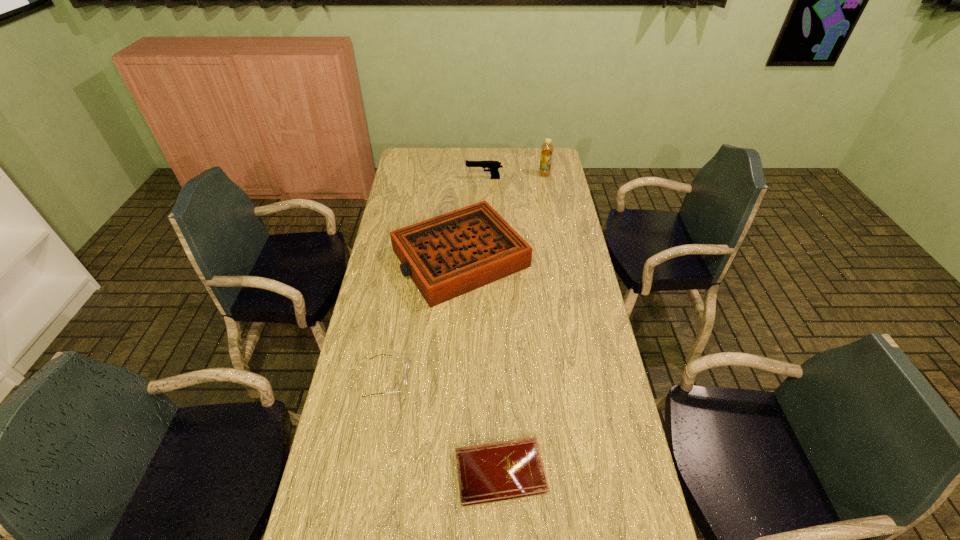
I want to click on the rightmost object, so click(547, 148).

In order to click on bottle in this screenshot , I will do `click(547, 148)`.

Identify the location of pistol. This screenshot has height=540, width=960. [493, 165].

The height and width of the screenshot is (540, 960). I want to click on gameboard, so click(449, 255).

This screenshot has width=960, height=540. I want to click on the fourth farthest object, so click(x=407, y=364).

Identify the location of the fourth tallest object. (407, 364).

Image resolution: width=960 pixels, height=540 pixels. Find the location of `the shortest object`. the shortest object is located at coordinates (500, 471).

Identify the location of the nearest object. The height and width of the screenshot is (540, 960). (500, 471).

In order to click on vacant space located 0.310m on the left of the rightmost object in this screenshot , I will do `click(475, 174)`.

The width and height of the screenshot is (960, 540). What are the coordinates of `free point located 0.260m on the front-facing side of the pistol` in the screenshot? It's located at (413, 178).